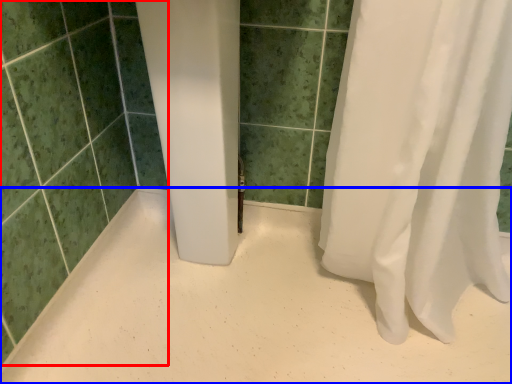
Question: Which object appears farthest to the camera in this image, ceramic tile (highlighted by a red box) or plain (highlighted by a blue box)?

Choices:
 (A) ceramic tile
 (B) plain

Answer: (B)